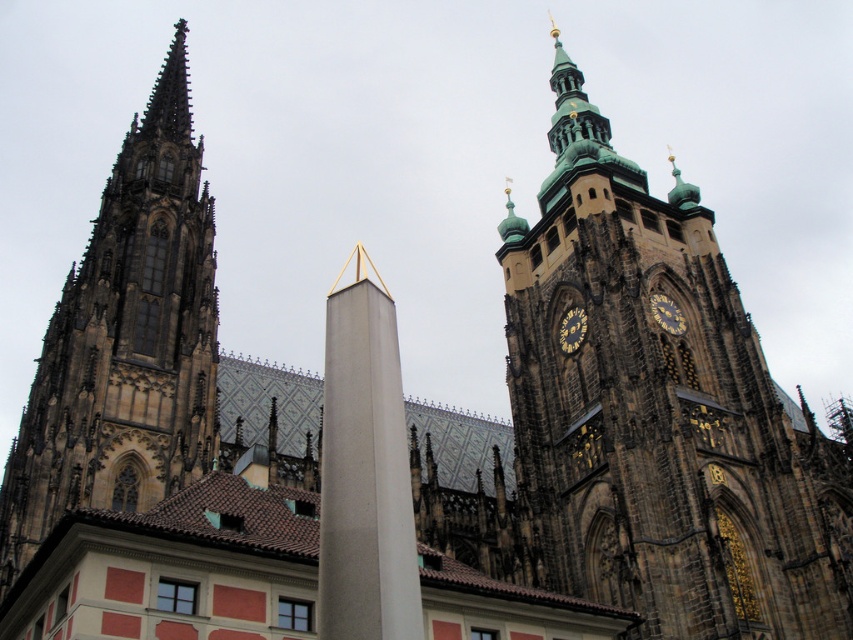
Question: Which object appears closest to the camera in this image?

Choices:
 (A) gold/brass/gilded clock at right
 (B) dark brown stone tower at upper center

Answer: (B)

Question: Does dark brown stone tower at upper center have a lesser width compared to slate gray stone obelisk at center?

Choices:
 (A) yes
 (B) no

Answer: (B)

Question: Which of the following is the closest to the observer?

Choices:
 (A) brown stone tower at left
 (B) dark brown stone tower at upper center

Answer: (A)

Question: Which object is the closest to the gold/brass/gilded clock at right?

Choices:
 (A) dark brown stone tower at upper center
 (B) gold metallic clock at center-right
 (C) slate gray stone obelisk at center
 (D) brown stone tower at left

Answer: (B)

Question: Is slate gray stone obelisk at center bigger than gold/brass/gilded clock at right?

Choices:
 (A) yes
 (B) no

Answer: (A)

Question: Is brown stone tower at left above gold/brass/gilded clock at right?

Choices:
 (A) no
 (B) yes

Answer: (B)